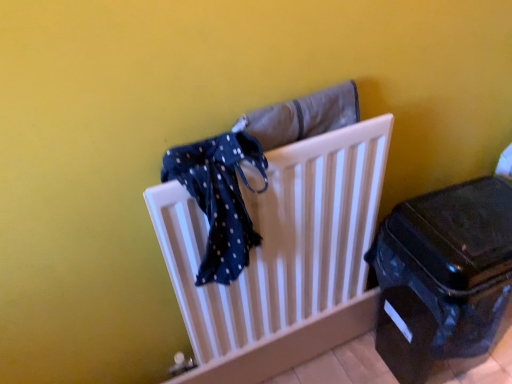
Question: Does white plastic radiator at center come in front of blue dotted fabric at center?

Choices:
 (A) no
 (B) yes

Answer: (A)

Question: Is blue dotted fabric at center located within white plastic radiator at center?

Choices:
 (A) yes
 (B) no

Answer: (A)

Question: Does white plastic radiator at center appear on the left side of blue dotted fabric at center?

Choices:
 (A) no
 (B) yes

Answer: (A)

Question: Could you tell me if white plastic radiator at center is facing blue dotted fabric at center?

Choices:
 (A) no
 (B) yes

Answer: (B)

Question: From a real-world perspective, is white plastic radiator at center under blue dotted fabric at center?

Choices:
 (A) no
 (B) yes

Answer: (B)

Question: Is white plastic radiator at center situated inside shiny black suitcase at lower right or outside?

Choices:
 (A) inside
 (B) outside

Answer: (B)

Question: In the image, is white plastic radiator at center on the left side or the right side of shiny black suitcase at lower right?

Choices:
 (A) left
 (B) right

Answer: (A)

Question: From the image's perspective, is white plastic radiator at center positioned above or below shiny black suitcase at lower right?

Choices:
 (A) above
 (B) below

Answer: (A)

Question: From a real-world perspective, is white plastic radiator at center positioned above or below shiny black suitcase at lower right?

Choices:
 (A) above
 (B) below

Answer: (A)

Question: In the image, is white plastic radiator at center positioned in front of or behind blue dotted fabric at center?

Choices:
 (A) front
 (B) behind

Answer: (B)

Question: Is white plastic radiator at center wider or thinner than blue dotted fabric at center?

Choices:
 (A) thin
 (B) wide

Answer: (A)

Question: Is white plastic radiator at center bigger or smaller than blue dotted fabric at center?

Choices:
 (A) small
 (B) big

Answer: (B)

Question: From the image's perspective, is white plastic radiator at center above or below blue dotted fabric at center?

Choices:
 (A) below
 (B) above

Answer: (A)

Question: Looking at the image, does shiny black suitcase at lower right seem bigger or smaller compared to blue dotted fabric at center?

Choices:
 (A) small
 (B) big

Answer: (B)

Question: Considering the positions of point (488, 188) and point (246, 150), is point (488, 188) closer or farther from the camera than point (246, 150)?

Choices:
 (A) farther
 (B) closer

Answer: (A)